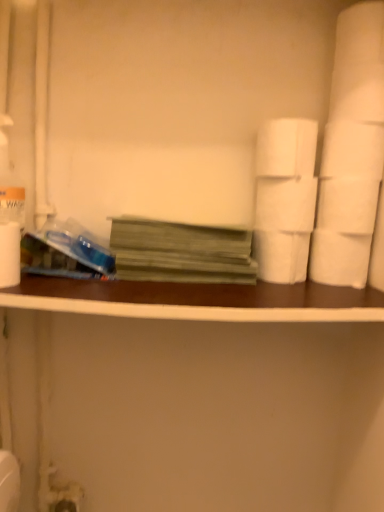
Find the location of `unoccupied area in front of green matte book at center`. unoccupied area in front of green matte book at center is located at coordinates (195, 292).